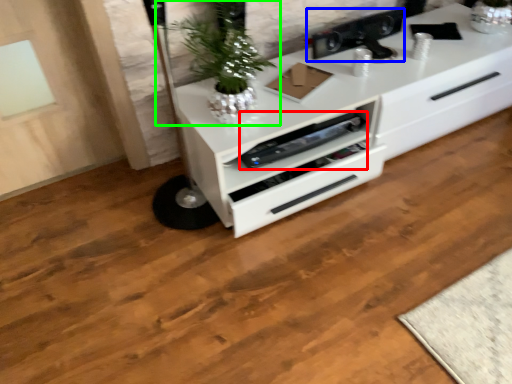
Question: Based on their relative distances, which object is nearer to appliance (highlighted by a red box)? Choose from appliance (highlighted by a blue box) and houseplant (highlighted by a green box).

Choices:
 (A) appliance
 (B) houseplant

Answer: (B)